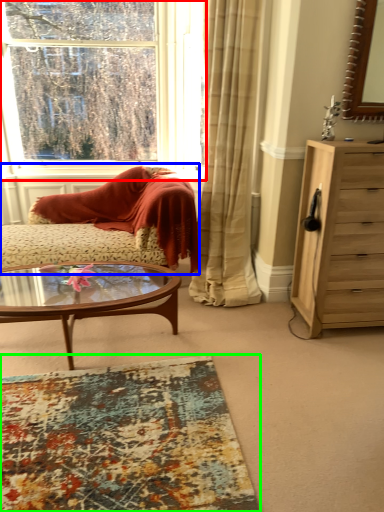
Question: Which is nearer to the window (highlighted by a red box)? studio couch (highlighted by a blue box) or plain (highlighted by a green box).

Choices:
 (A) studio couch
 (B) plain

Answer: (A)